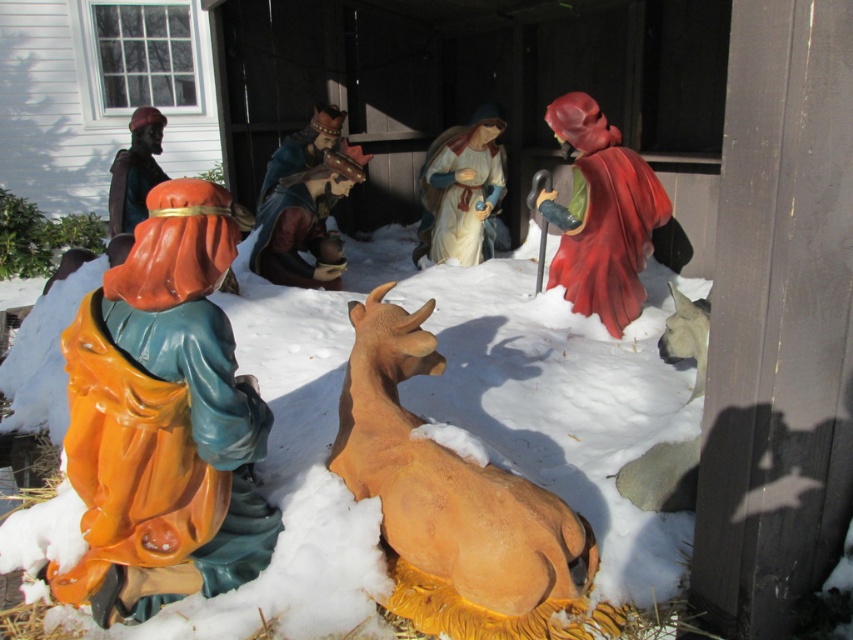
Question: Is white matte snow at center to the left of matte black figure at upper left from the viewer's perspective?

Choices:
 (A) no
 (B) yes

Answer: (A)

Question: Which of the following is the closest to the observer?

Choices:
 (A) matte black figure at upper left
 (B) shiny red robe at upper right
 (C) matte brown cow at center
 (D) white matte snow at center

Answer: (C)

Question: Can you confirm if matte orange figure at left is positioned to the left of shiny red robe at upper right?

Choices:
 (A) yes
 (B) no

Answer: (A)

Question: Among these objects, which one is nearest to the camera?

Choices:
 (A) matte plastic mary at center
 (B) matte plastic baby at center
 (C) matte black figure at upper left
 (D) shiny red robe at upper right

Answer: (D)

Question: Does shiny red robe at upper right have a greater width compared to matte black figure at upper left?

Choices:
 (A) no
 (B) yes

Answer: (B)

Question: Which object appears farthest from the camera in this image?

Choices:
 (A) matte plastic king at center
 (B) matte plastic baby at center
 (C) matte plastic mary at center

Answer: (C)